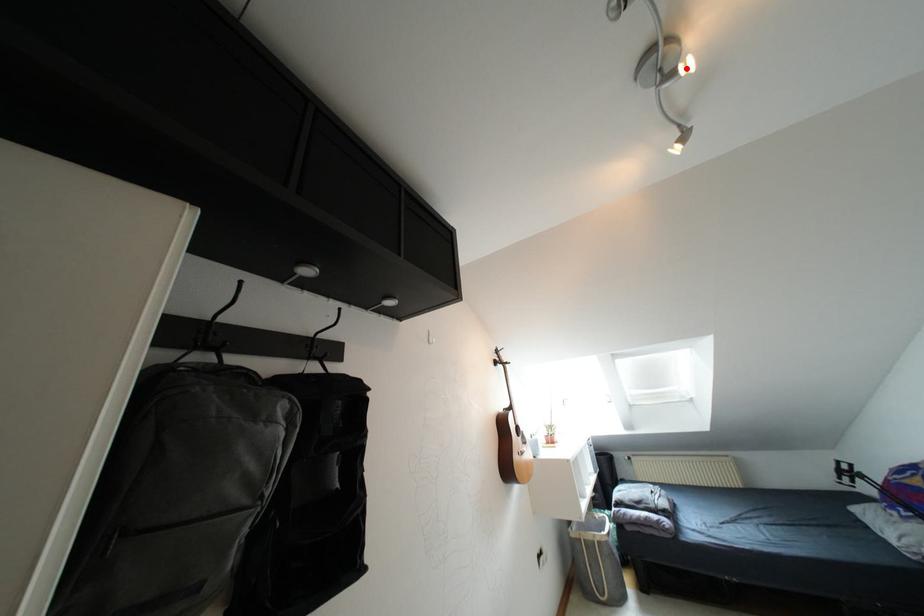
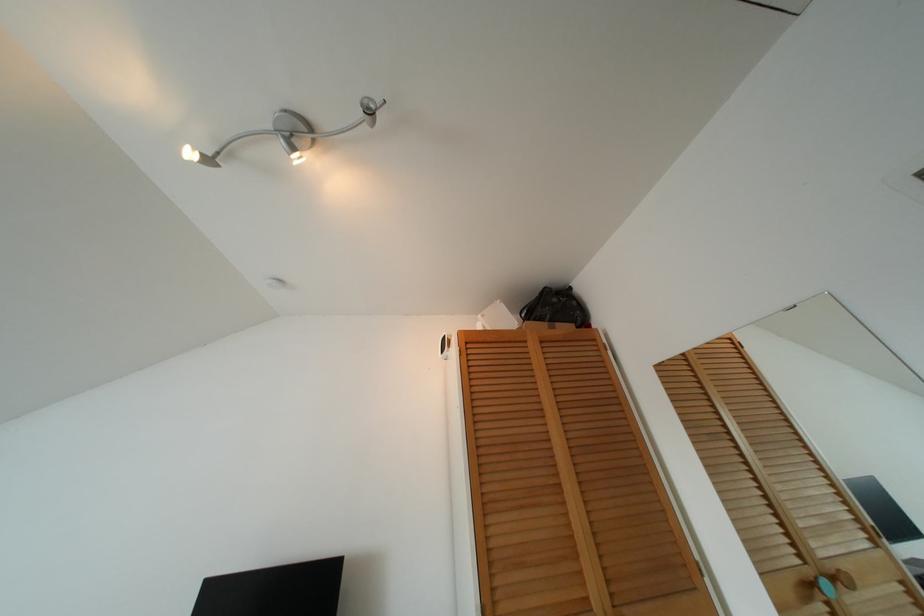
Find the pixel in the second image that matches the highlighted location in the first image.

(297, 158)